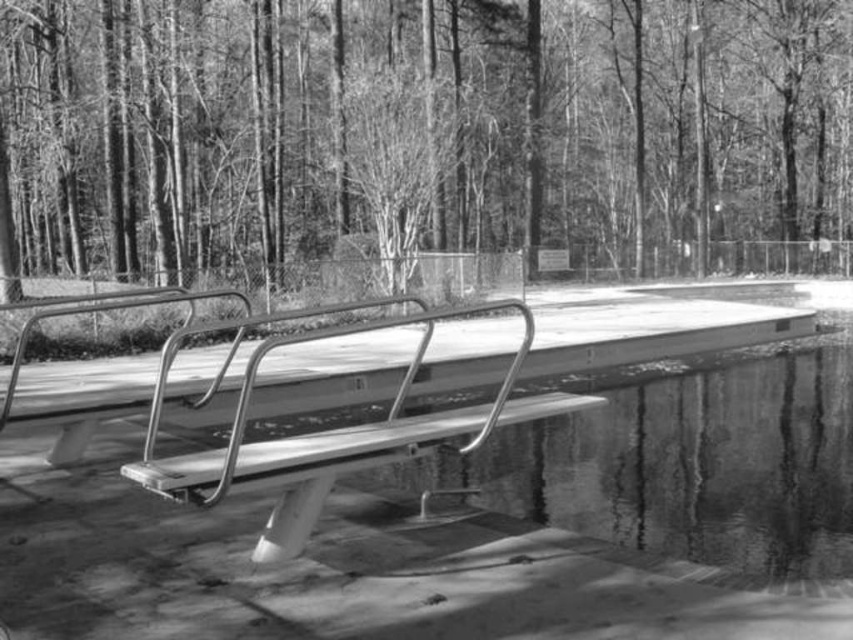
Based on the photo, does smooth bark tree at center have a lesser width compared to metallic silver bench at center?

No, smooth bark tree at center is not thinner than metallic silver bench at center.

Which of these two, smooth bark tree at center or metallic silver bench at center, stands shorter?

metallic silver bench at center is shorter.

Does point (235, 140) come behind point (169, 358)?

Yes, it is.

I want to click on smooth bark tree at center, so click(x=422, y=134).